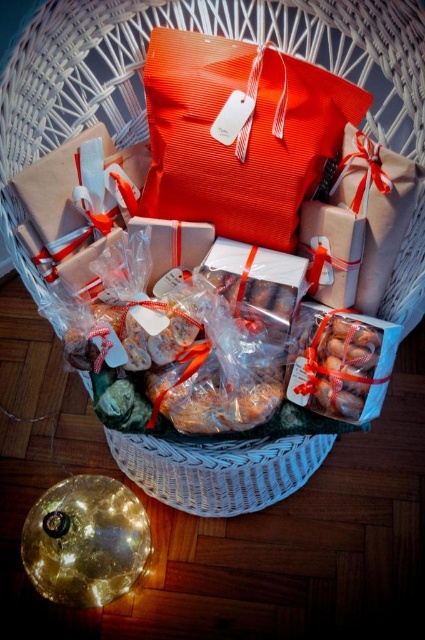
Consider the image. Is matte orange fabric gift bag at center positioned at the back of translucent plastic bag of cookies at center?

That is False.

What do you see at coordinates (240, 132) in the screenshot? The width and height of the screenshot is (425, 640). I see `matte orange fabric gift bag at center` at bounding box center [240, 132].

Where is `matte orange fabric gift bag at center`? matte orange fabric gift bag at center is located at coordinates (240, 132).